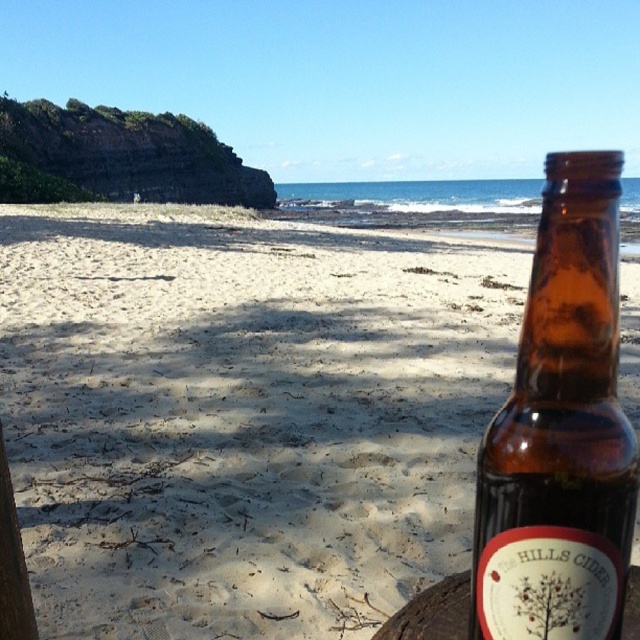
Question: Which point is closer to the camera taking this photo?

Choices:
 (A) (531, 300)
 (B) (452, 474)

Answer: (B)

Question: Among these objects, which one is farthest from the camera?

Choices:
 (A) sandytexture at lower left
 (B) brown glass bottle at right

Answer: (B)

Question: Is sandytexture at lower left to the right of brown glass bottle at right from the viewer's perspective?

Choices:
 (A) yes
 (B) no

Answer: (B)

Question: Does sandytexture at lower left have a greater width compared to brown glass bottle at right?

Choices:
 (A) no
 (B) yes

Answer: (B)

Question: Can you confirm if sandytexture at lower left is positioned to the left of brown glass bottle at right?

Choices:
 (A) no
 (B) yes

Answer: (B)